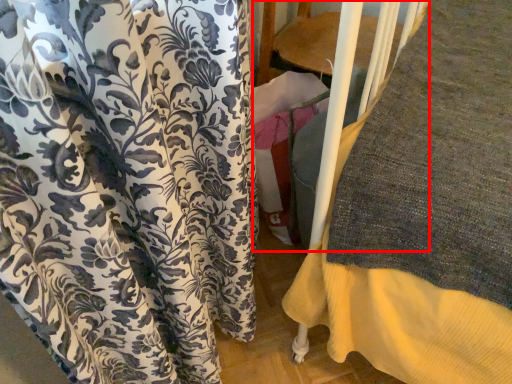
Question: Observing the image, what is the correct spatial positioning of bunk bed (annotated by the red box) in reference to curtain?

Choices:
 (A) left
 (B) right

Answer: (B)